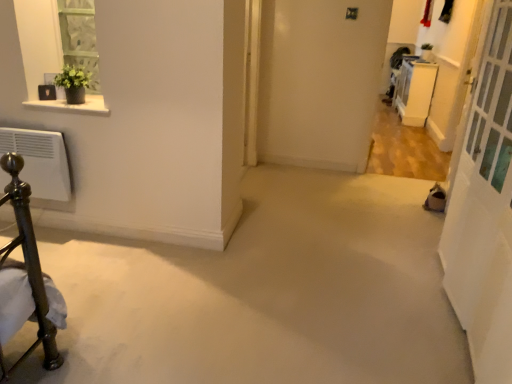
Question: From a real-world perspective, is white glossy cabinet at upper right located higher than white glass screen door at right?

Choices:
 (A) no
 (B) yes

Answer: (A)

Question: Considering the relative sizes of white glossy cabinet at upper right and white glass screen door at right in the image provided, is white glossy cabinet at upper right shorter than white glass screen door at right?

Choices:
 (A) no
 (B) yes

Answer: (B)

Question: Is white glossy cabinet at upper right to the left of white glass screen door at right from the viewer's perspective?

Choices:
 (A) no
 (B) yes

Answer: (A)

Question: Is white glossy cabinet at upper right further to the viewer compared to white glass screen door at right?

Choices:
 (A) no
 (B) yes

Answer: (B)

Question: Would you say white glossy cabinet at upper right is outside white glass screen door at right?

Choices:
 (A) no
 (B) yes

Answer: (B)

Question: Looking at their shapes, would you say white glass screen door at right is wider or thinner than white marble shelf at upper left?

Choices:
 (A) wide
 (B) thin

Answer: (A)

Question: Based on their sizes in the image, would you say white glass screen door at right is bigger or smaller than white marble shelf at upper left?

Choices:
 (A) small
 (B) big

Answer: (B)

Question: From the image's perspective, is white glass screen door at right positioned above or below white marble shelf at upper left?

Choices:
 (A) below
 (B) above

Answer: (A)

Question: Is white glass screen door at right inside the boundaries of white marble shelf at upper left, or outside?

Choices:
 (A) outside
 (B) inside

Answer: (A)

Question: In terms of size, does white marble shelf at upper left appear bigger or smaller than white glass screen door at right?

Choices:
 (A) small
 (B) big

Answer: (A)

Question: In terms of width, does white marble shelf at upper left look wider or thinner when compared to white glass screen door at right?

Choices:
 (A) wide
 (B) thin

Answer: (B)

Question: From a real-world perspective, is white marble shelf at upper left above or below white glass screen door at right?

Choices:
 (A) above
 (B) below

Answer: (A)

Question: From the image's perspective, is white marble shelf at upper left positioned above or below white glass screen door at right?

Choices:
 (A) above
 (B) below

Answer: (A)

Question: From a real-world perspective, is white glass screen door at right positioned above or below white glossy cabinet at upper right?

Choices:
 (A) above
 (B) below

Answer: (A)

Question: Is white glass screen door at right taller or shorter than white glossy cabinet at upper right?

Choices:
 (A) short
 (B) tall

Answer: (B)